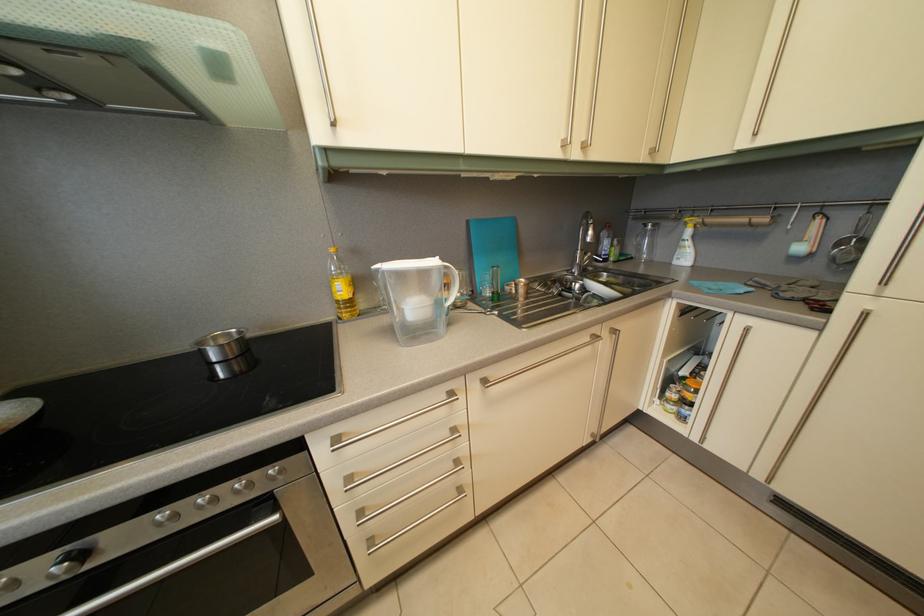
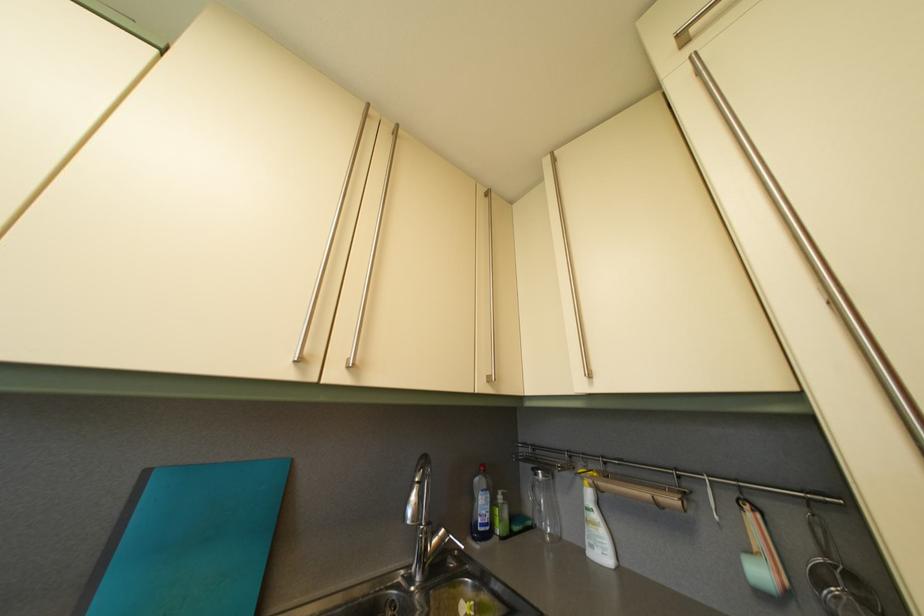
The point at (x=653, y=233) is marked in the first image. Where is the corresponding point in the second image?

(544, 482)